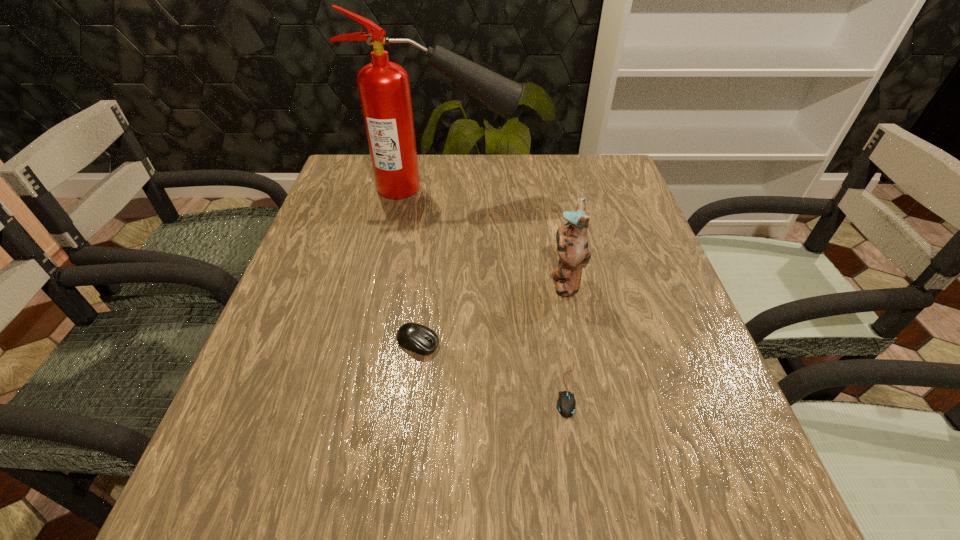
In the image, there is a desktop. Where is `vacant area at the right edge`? vacant area at the right edge is located at coordinates (632, 248).

The height and width of the screenshot is (540, 960). What are the coordinates of `vacant space at the far left corner of the desktop` in the screenshot? It's located at (340, 186).

Find the location of a particular element. This screenshot has width=960, height=540. free space at the far right corner of the desktop is located at coordinates (570, 175).

The image size is (960, 540). I want to click on unoccupied area between the shorter mouse and the tallest object, so click(x=503, y=289).

The image size is (960, 540). Identify the location of free area in between the second farthest object and the shorter mouse. (565, 335).

At what (x,y) coordinates should I click in order to perform the action: click on blank region between the tallest object and the taller mouse. Please return your answer as a coordinate pair (x, y). The image size is (960, 540). Looking at the image, I should click on (429, 266).

What are the coordinates of `free spot between the farthest object and the second nearest object` in the screenshot? It's located at (429, 266).

At what (x,y) coordinates should I click in order to perform the action: click on free space that is in between the tallest object and the figurine. Please return your answer as a coordinate pair (x, y). The width and height of the screenshot is (960, 540). Looking at the image, I should click on (502, 235).

Identify the location of unoccupied position between the fire extinguisher and the nearest object. (503, 289).

Identify the location of vacant space that is in between the third tallest object and the farthest object. (429, 266).